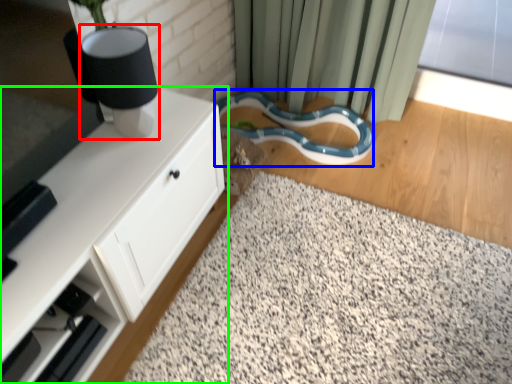
Question: Considering the real-world distances, which object is farthest from table lamp (highlighted by a red box)? snake (highlighted by a blue box) or cabinetry (highlighted by a green box)?

Choices:
 (A) snake
 (B) cabinetry

Answer: (A)